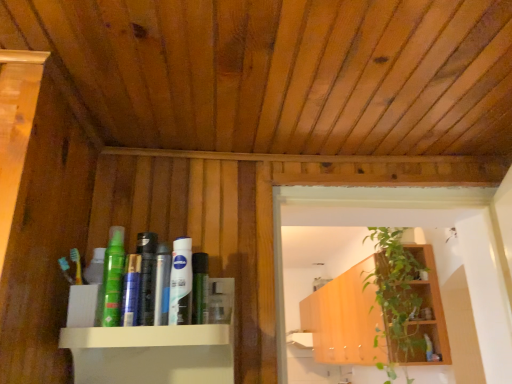
Question: Is white glossy lotion at center, which is the fourth toiletry from right to left, situated inside clear plastic bottle at center, the sixth toiletry positioned from the left, or outside?

Choices:
 (A) outside
 (B) inside

Answer: (A)

Question: Looking at their shapes, would you say white glossy lotion at center, which ranks as the 4th toiletry in left-to-right order, is wider or thinner than clear plastic bottle at center, positioned as the 2th toiletry in back-to-front order?

Choices:
 (A) wide
 (B) thin

Answer: (B)

Question: Based on their relative distances, which object is nearer to the wooden cabinet at center?

Choices:
 (A) shiny black bottle at center, the fourth toiletry in the front-to-back sequence
 (B) blue matte toothpaste at center
 (C) clear plastic bottle at center, which appears as the sixth toiletry when viewed from the front
 (D) silver metallic can at center, which appears as the third toiletry when viewed from the front
 (E) matte black hair spray at upper center, acting as the 7th toiletry starting from the front

Answer: (E)

Question: Which of these objects is positioned farthest from the white glossy lotion at center, which ranks as the 4th toiletry in left-to-right order?

Choices:
 (A) silver metallic can at center, which is the 3th toiletry from left to right
 (B) wooden cabinet at center
 (C) green matte spray can at center, marked as the 1th toiletry in a front-to-back arrangement
 (D) green matte tube at center, acting as the 3th toiletry starting from the right
 (E) green leafy plant at upper right

Answer: (B)